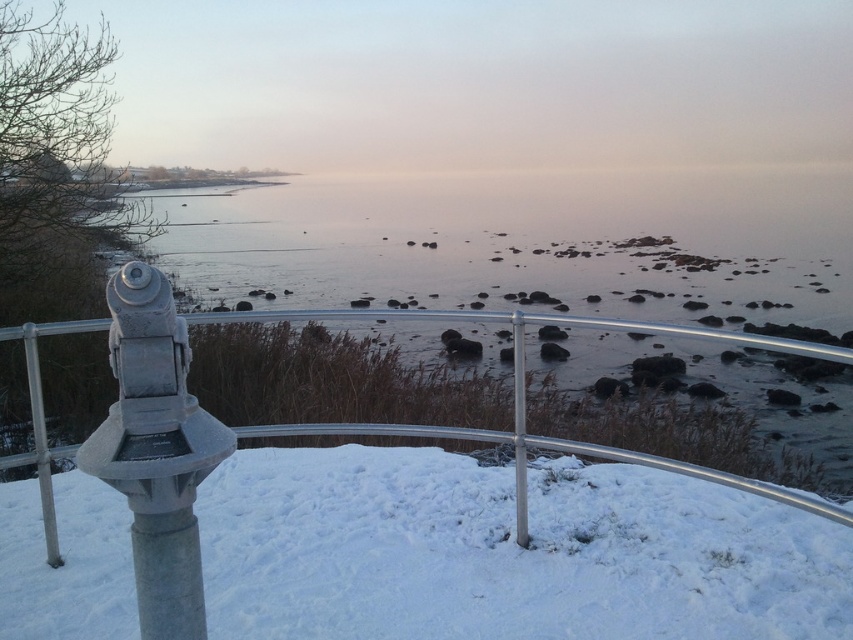
Can you confirm if white fluffy snow at center is wider than silver metallic fence at center?

Correct, the width of white fluffy snow at center exceeds that of silver metallic fence at center.

Does point (612, 516) lie behind point (453, 435)?

Yes, it is behind point (453, 435).

You are a GUI agent. You are given a task and a screenshot of the screen. Output one action in this format:
    pyautogui.click(x=<x>, y=<y>)
    Task: Click on the white fluffy snow at center
    Image resolution: width=853 pixels, height=640 pixels.
    Given the screenshot: What is the action you would take?
    click(506, 552)